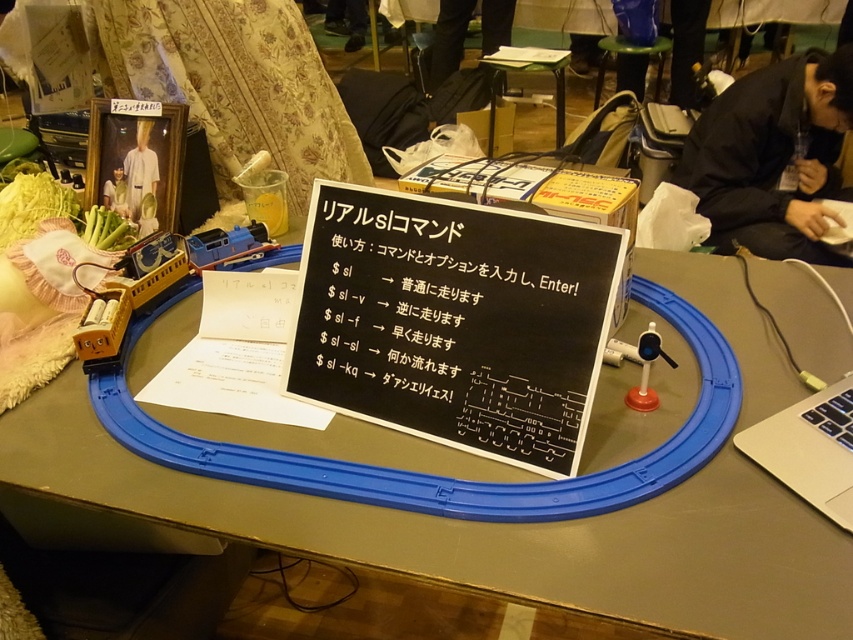
Question: Is the position of black paper at center less distant than that of black fabric at upper right?

Choices:
 (A) yes
 (B) no

Answer: (A)

Question: Based on their relative distances, which object is farther from the black fabric at upper right?

Choices:
 (A) matte white shirt at upper left
 (B) white fabric at center
 (C) black paper at center

Answer: (A)

Question: Can you confirm if blue plastic track at center is positioned above black paper at center?

Choices:
 (A) no
 (B) yes

Answer: (A)

Question: Which of these objects is positioned farthest from the blue plastic track at center?

Choices:
 (A) black fabric at upper right
 (B) white fabric at center

Answer: (A)

Question: Among these points, which one is nearest to the camera?

Choices:
 (A) (102, 198)
 (B) (132, 148)

Answer: (B)

Question: Is blue plastic track at center to the right of black paper at center from the viewer's perspective?

Choices:
 (A) no
 (B) yes

Answer: (B)